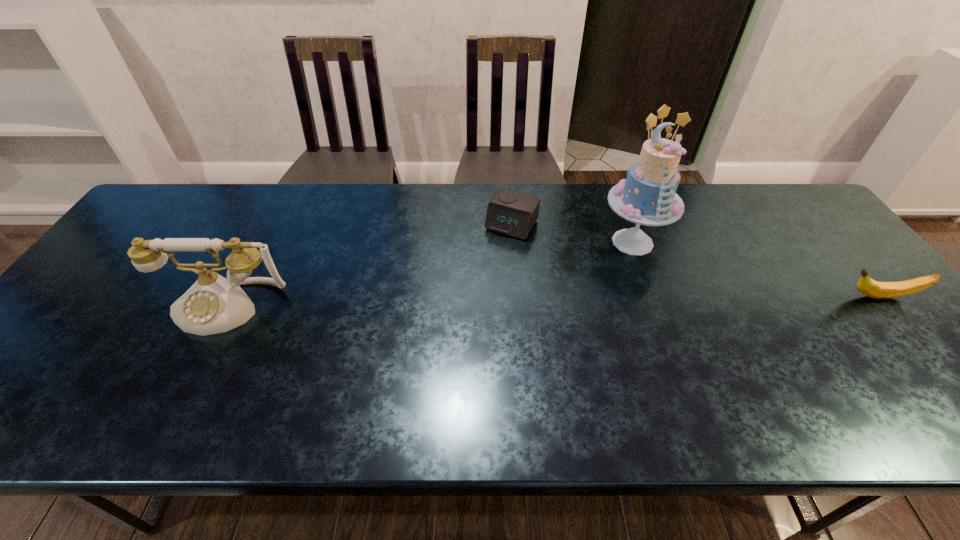
You are a GUI agent. You are given a task and a screenshot of the screen. Output one action in this format:
    pyautogui.click(x=<x>, y=<y>)
    Task: Click on the vacant region between the alarm clock and the banana
    Image resolution: width=960 pixels, height=540 pixels.
    Given the screenshot: What is the action you would take?
    pyautogui.click(x=696, y=261)

Where is `free spot between the banana and the tallest object`? The width and height of the screenshot is (960, 540). free spot between the banana and the tallest object is located at coordinates (756, 269).

At what (x,y) coordinates should I click in order to perform the action: click on empty space between the tallest object and the rightmost object. Please return your answer as a coordinate pair (x, y). The height and width of the screenshot is (540, 960). Looking at the image, I should click on (756, 269).

At what (x,y) coordinates should I click in order to perform the action: click on free space between the third shortest object and the cake. Please return your answer as a coordinate pair (x, y). This screenshot has width=960, height=540. Looking at the image, I should click on (429, 274).

Image resolution: width=960 pixels, height=540 pixels. What are the coordinates of `free space between the alarm clock and the rightmost object` in the screenshot? It's located at (696, 261).

Identify which object is the nearest to the third object from left to right. Please provide its 2D coordinates. Your answer should be formatted as a tuple, i.e. [(x, y)], where the tuple contains the x and y coordinates of a point satisfying the conditions above.

[(511, 213)]

At what (x,y) coordinates should I click in order to perform the action: click on object that is the third closest one to the leftmost object. Please return your answer as a coordinate pair (x, y). Looking at the image, I should click on (878, 290).

At what (x,y) coordinates should I click in order to perform the action: click on blank space that satisfies the following two spatial constraints: 1. on the front side of the banana; 2. at the stem of the tallest object. Please return your answer as a coordinate pair (x, y). This screenshot has width=960, height=540. Looking at the image, I should click on (653, 297).

Locate an element on the screen. vacant position in the image that satisfies the following two spatial constraints: 1. on the front side of the tallest object; 2. on the right side of the alarm clock is located at coordinates (513, 242).